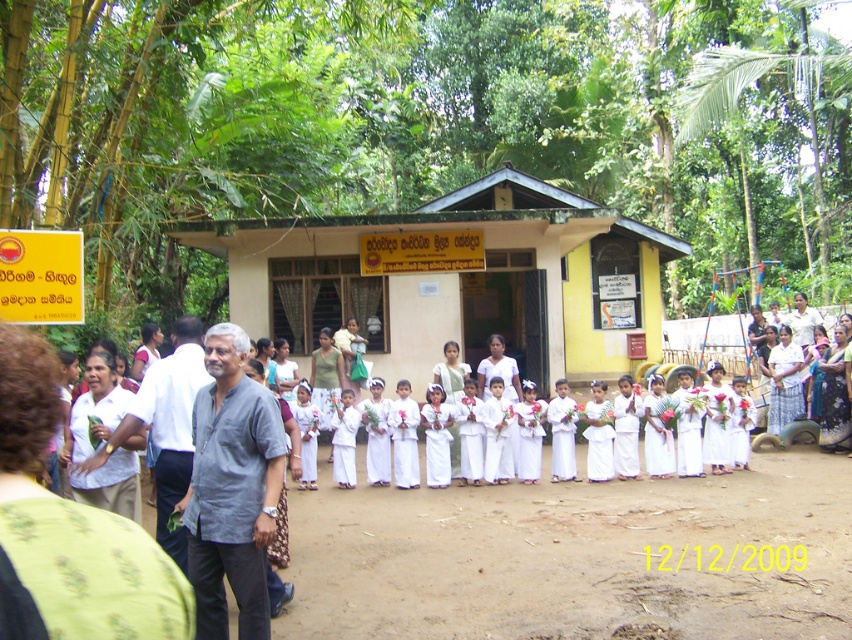
You are a photographer at the event and need to capture a photo of the beige painted wood hut at center without the white cloth at center appearing in the background. Is it possible to do so given their positions?

The white cloth at center is behind the beige painted wood hut at center, so yes, the photographer can position themselves in front of the beige painted wood hut at center to block the white cloth at center from the background.

Looking at this image, you are a photographer positioned in front of the building and want to capture both the light gray shirt at left and the white cloth at center in your photo. Which object should you focus on first to ensure both are in sharp focus?

Since the light gray shirt at left is closer to the viewer than the white cloth at center, you should focus on the light gray shirt at left first. This will ensure the white cloth at center remains within the depth of field and appears sharp in the photo.